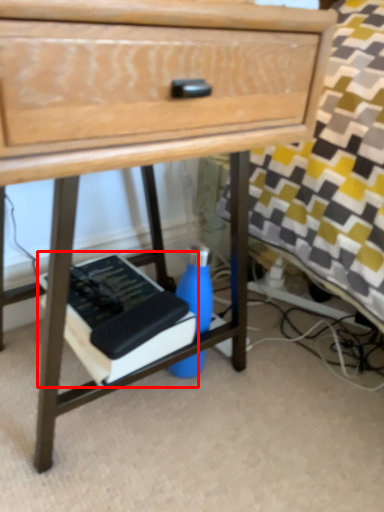
Question: From the image's perspective, considering the relative positions of paperback book (annotated by the red box) and bottle in the image provided, where is paperback book (annotated by the red box) located with respect to the staircase?

Choices:
 (A) below
 (B) above

Answer: (B)